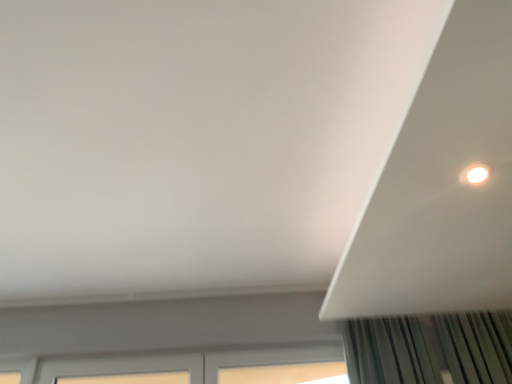
What do you see at coordinates (442, 185) in the screenshot? Image resolution: width=512 pixels, height=384 pixels. I see `white matte exhaust hood at upper right` at bounding box center [442, 185].

Image resolution: width=512 pixels, height=384 pixels. Find the location of `white matte exhaust hood at upper right`. white matte exhaust hood at upper right is located at coordinates click(x=442, y=185).

You are a GUI agent. You are given a task and a screenshot of the screen. Output one action in this format:
    pyautogui.click(x=<x>, y=<y>)
    Task: Click on the white wooden window at lower center
    This screenshot has width=512, height=384.
    Given the screenshot: What is the action you would take?
    pyautogui.click(x=187, y=366)

Describe the element at coordinates (187, 366) in the screenshot. The image size is (512, 384). I see `white wooden window at lower center` at that location.

Locate an element on the screen. The width and height of the screenshot is (512, 384). white matte exhaust hood at upper right is located at coordinates (442, 185).

Which is more to the right, white wooden window at lower center or white matte exhaust hood at upper right?

white matte exhaust hood at upper right is more to the right.

Which object is further away from the camera, white wooden window at lower center or white matte exhaust hood at upper right?

white wooden window at lower center is further from the camera.

Which is farther from the camera, [316,369] or [497,190]?

Point [316,369]

From the picture: From the image's perspective, which object appears higher, white wooden window at lower center or white matte exhaust hood at upper right?

white matte exhaust hood at upper right.

From a real-world perspective, is white wooden window at lower center on white matte exhaust hood at upper right?

Incorrect, from a real-world perspective, white wooden window at lower center is lower than white matte exhaust hood at upper right.

Is white wooden window at lower center thinner than white matte exhaust hood at upper right?

Indeed, white wooden window at lower center has a lesser width compared to white matte exhaust hood at upper right.

Does white wooden window at lower center have a lesser height compared to white matte exhaust hood at upper right?

In fact, white wooden window at lower center may be taller than white matte exhaust hood at upper right.

Considering the sizes of objects white wooden window at lower center and white matte exhaust hood at upper right in the image provided, who is smaller, white wooden window at lower center or white matte exhaust hood at upper right?

Smaller between the two is white wooden window at lower center.

From the picture: Would you say white wooden window at lower center is inside or outside white matte exhaust hood at upper right?

white wooden window at lower center is outside white matte exhaust hood at upper right.

Is white wooden window at lower center not close to white matte exhaust hood at upper right?

Indeed, white wooden window at lower center is not near white matte exhaust hood at upper right.

Is white wooden window at lower center positioned with its back to white matte exhaust hood at upper right?

No, white wooden window at lower center is not facing the opposite direction of white matte exhaust hood at upper right.

How different are the orientations of white wooden window at lower center and white matte exhaust hood at upper right in degrees?

They differ by 90.9 degrees in their facing directions.

You are a GUI agent. You are given a task and a screenshot of the screen. Output one action in this format:
    pyautogui.click(x=<x>, y=<y>)
    Task: Click on the exhaust hood in front of the white wooden window at lower center
    This screenshot has height=384, width=512.
    Given the screenshot: What is the action you would take?
    pyautogui.click(x=442, y=185)

From the picture: Based on their positions, is white matte exhaust hood at upper right located to the left or right of white wooden window at lower center?

white matte exhaust hood at upper right is positioned on white wooden window at lower center's right side.

Which object is more forward, white matte exhaust hood at upper right or white wooden window at lower center?

white matte exhaust hood at upper right.

Is point (423, 157) positioned behind point (234, 367)?

No, (423, 157) is in front of (234, 367).

From the image's perspective, which is below, white matte exhaust hood at upper right or white wooden window at lower center?

white wooden window at lower center.

From a real-world perspective, is white matte exhaust hood at upper right positioned above or below white wooden window at lower center?

From a real-world perspective, white matte exhaust hood at upper right is physically above white wooden window at lower center.

Looking at their sizes, would you say white matte exhaust hood at upper right is wider or thinner than white wooden window at lower center?

Considering their sizes, white matte exhaust hood at upper right looks broader than white wooden window at lower center.

Considering the sizes of white matte exhaust hood at upper right and white wooden window at lower center in the image, is white matte exhaust hood at upper right taller or shorter than white wooden window at lower center?

Considering their sizes, white matte exhaust hood at upper right has less height than white wooden window at lower center.

Based on their sizes in the image, would you say white matte exhaust hood at upper right is bigger or smaller than white wooden window at lower center?

Clearly, white matte exhaust hood at upper right is larger in size than white wooden window at lower center.

Is white matte exhaust hood at upper right outside of white wooden window at lower center?

white matte exhaust hood at upper right is positioned outside white wooden window at lower center.

Does white matte exhaust hood at upper right touch white wooden window at lower center?

No, white matte exhaust hood at upper right is not in contact with white wooden window at lower center.

Is white matte exhaust hood at upper right aimed at white wooden window at lower center?

No, white matte exhaust hood at upper right is not turned towards white wooden window at lower center.

Locate an element on the screen. The height and width of the screenshot is (384, 512). exhaust hood on the right of white wooden window at lower center is located at coordinates (442, 185).

In the image, there is a white matte exhaust hood at upper right. Identify the location of window below it (from the image's perspective). The height and width of the screenshot is (384, 512). (187, 366).

This screenshot has width=512, height=384. Identify the location of window lying behind the white matte exhaust hood at upper right. (187, 366).